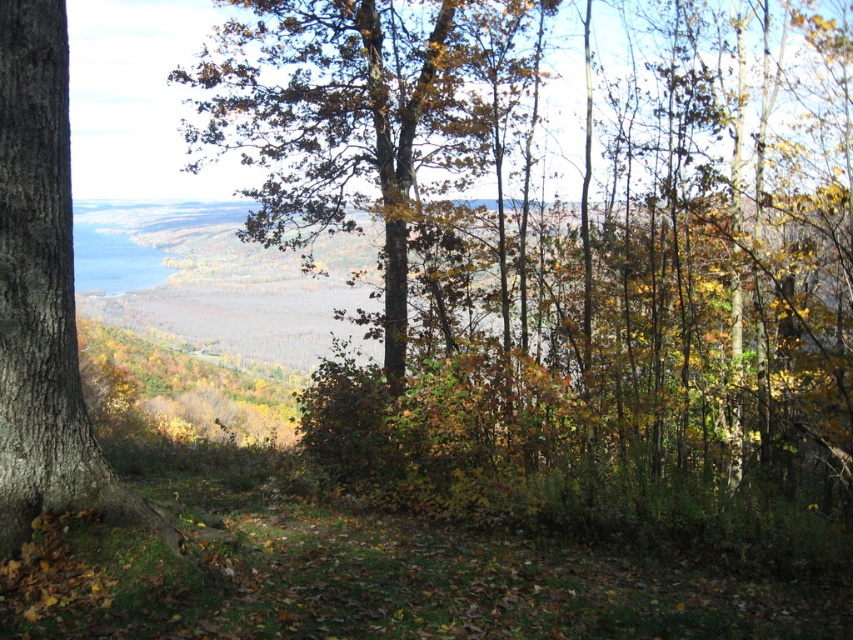
Question: Which point is farther to the camera?

Choices:
 (A) brown rough tree trunk at left
 (B) brown textured tree at center

Answer: (B)

Question: Is brown textured tree at center closer to the viewer compared to brown rough tree trunk at left?

Choices:
 (A) no
 (B) yes

Answer: (A)

Question: Does brown textured tree at center have a lesser width compared to brown rough tree trunk at left?

Choices:
 (A) yes
 (B) no

Answer: (B)

Question: Does brown textured tree at center appear over brown rough tree trunk at left?

Choices:
 (A) yes
 (B) no

Answer: (A)

Question: Which of the following is the farthest from the observer?

Choices:
 (A) (68, 500)
 (B) (276, 19)

Answer: (B)